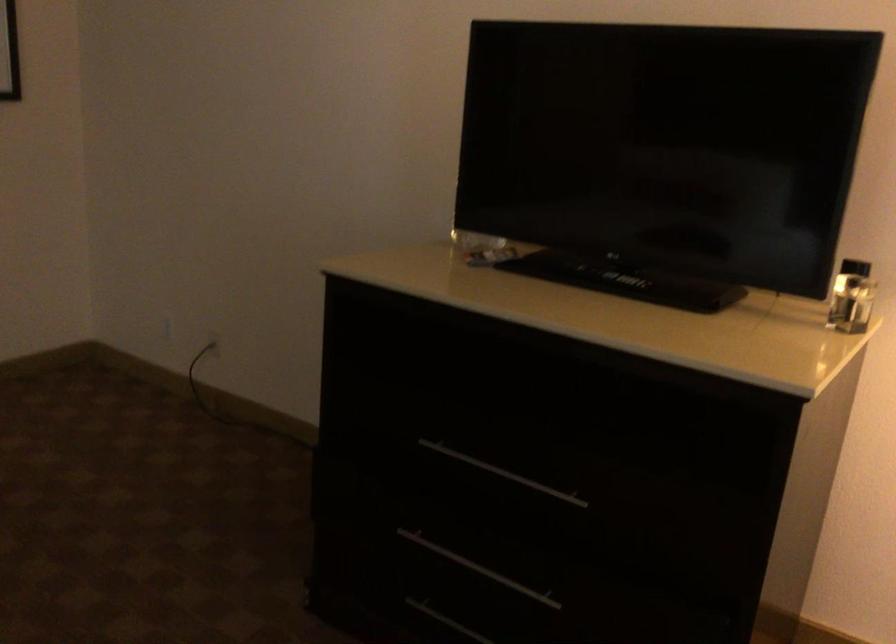
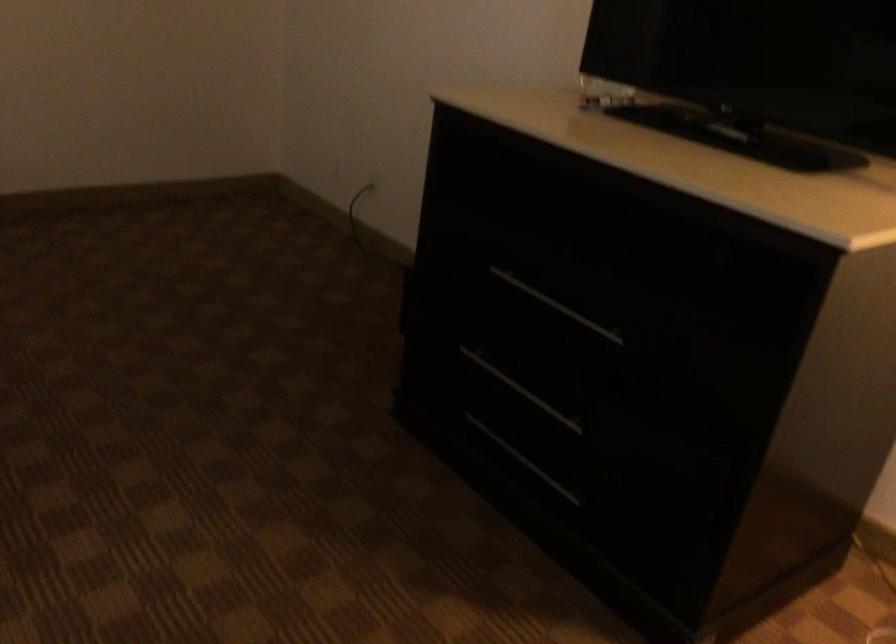
Question: The camera is either moving clockwise (left) or counter-clockwise (right) around the object. The first image is from the beginning of the video and the second image is from the end. Is the camera moving left or right when shooting the video?

Choices:
 (A) Left
 (B) Right

Answer: (B)